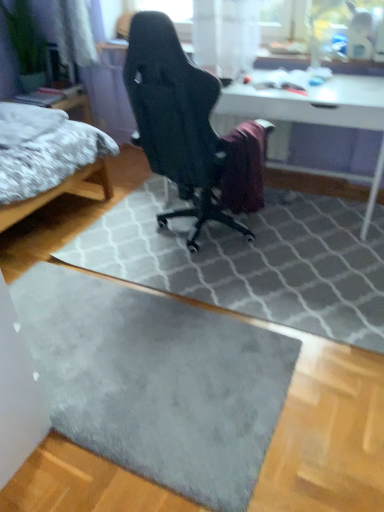
Question: In the image, is gray fluffy bed at left positioned in front of or behind black mesh chair at center?

Choices:
 (A) front
 (B) behind

Answer: (B)

Question: Considering the positions of gray fluffy bed at left and black mesh chair at center in the image, is gray fluffy bed at left taller or shorter than black mesh chair at center?

Choices:
 (A) tall
 (B) short

Answer: (B)

Question: Which object is the closest to the black mesh chair at center?

Choices:
 (A) gray soft rug at lower center
 (B) gray fluffy bed at left
 (C) white glossy table at center

Answer: (C)

Question: Based on their relative distances, which object is farther from the white glossy table at center?

Choices:
 (A) black mesh chair at center
 (B) gray soft rug at lower center
 (C) gray fluffy bed at left

Answer: (B)